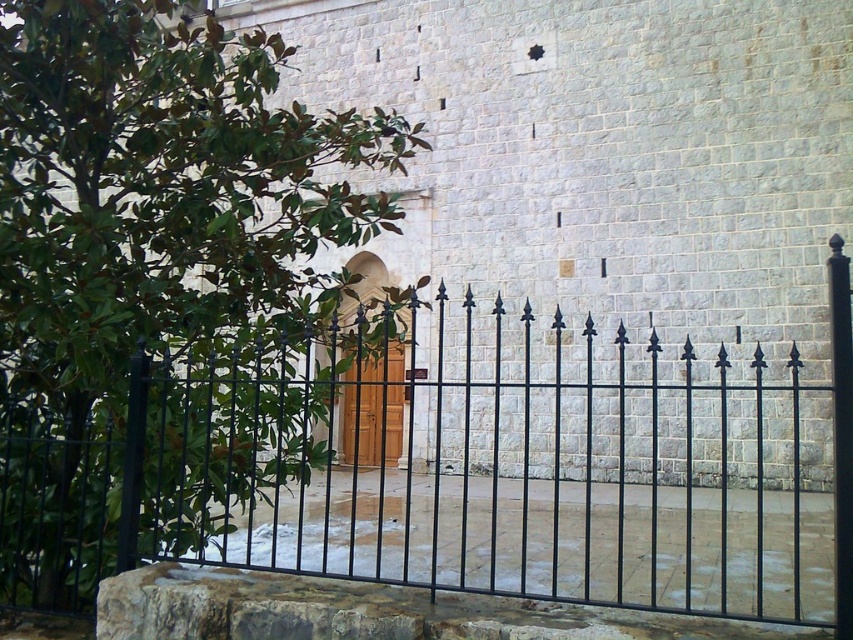
From the picture: You are a delivery person trying to deliver a package to the wooden door at center. The black wrought iron fence at center is blocking your path. Can you walk around the fence to reach the door?

The black wrought iron fence at center is 7.09 feet away from wooden door at center, so you can walk around the fence to reach the door since there is enough space between them.

You are a visitor approaching the entrance of the historical building. You see the green leafy tree at left and the wooden door at center. Which object is closer to you as you approach the entrance?

The green leafy tree at left is closer to the viewer than the wooden door at center, so the green leafy tree at left is closer to you as you approach the entrance.

You are a maintenance worker needing to water the green leafy tree at left. You have a hose that can reach up to 2 meters. Can you water the tree without moving the hose from the wooden door at center?

The distance between the green leafy tree at left and the wooden door at center is 2.21 meters. Since the hose can only reach up to 2 meters, it is not long enough to reach the tree from the door. You would need to move closer or use a longer hose.